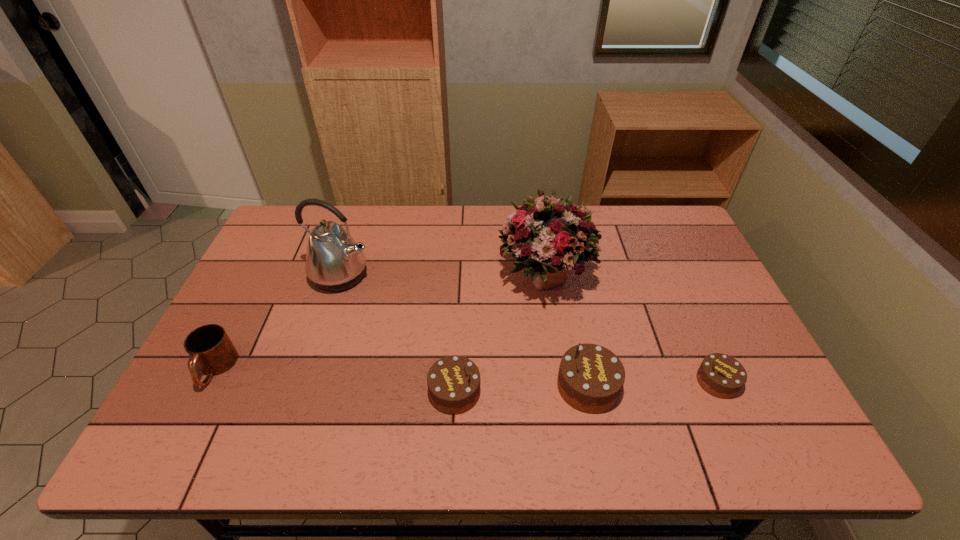
I want to click on vacant spot to place a chocolate cake on the left, so click(x=320, y=396).